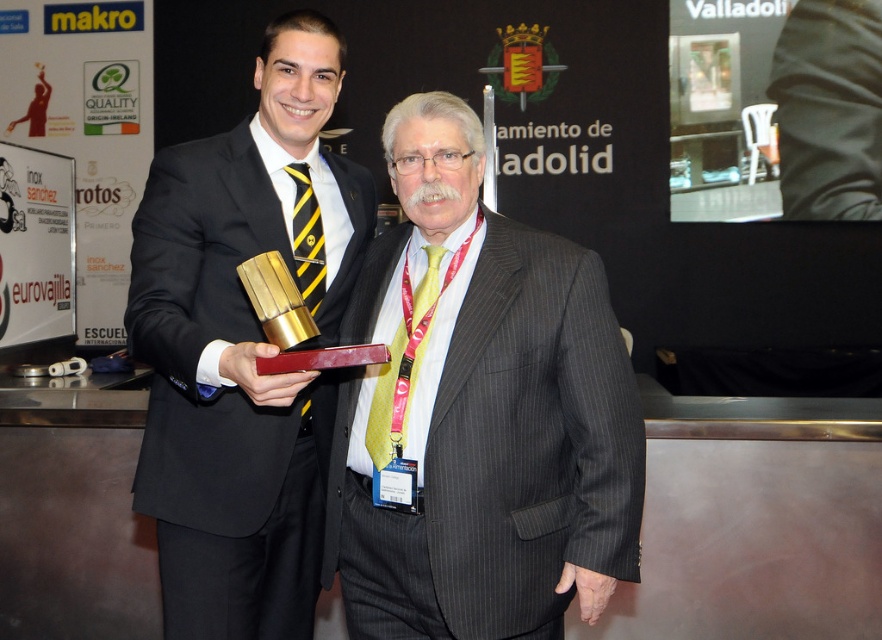
You are organizing a photo shoot and need to ensure that all items in the scene are visible in the frame. Given that the camera can only focus on objects within a 1.2 meter height range, and the pinstriped suit at center and yellowstriped fabrictie at center are the main subjects, will both items fit within the camera focus range?

The pinstriped suit at center has a larger size compared to yellowstriped fabrictie at center. Since the camera can focus on objects within a 1.2 meter height range, and the pinstriped suit is larger, it may extend beyond the focus range. However, since both are at the center, they are likely positioned to be within the frame. Without exact measurements, it is uncertain if both will fit.